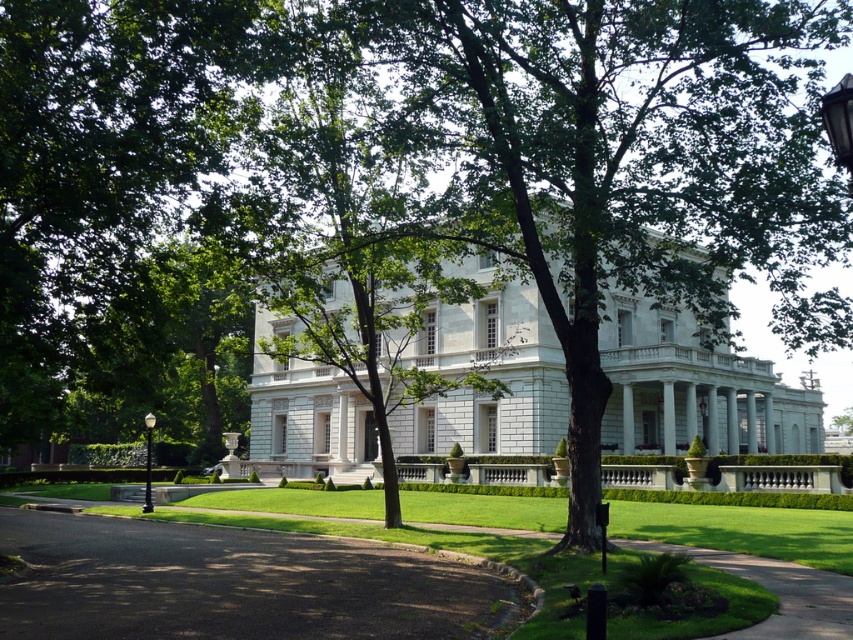
Question: Which object is positioned farthest from the white stone mansion at center?

Choices:
 (A) black polished metal lamp post at left
 (B) dark asphalt driveway at lower left
 (C) black glass lamp post at upper right

Answer: (C)

Question: Which of the following is the closest to the observer?

Choices:
 (A) black glass lamp post at upper right
 (B) white stone mansion at center
 (C) black polished metal lamp post at left
 (D) dark asphalt driveway at lower left

Answer: (A)

Question: Can you confirm if white stone mansion at center is positioned to the right of black glass lamp post at upper right?

Choices:
 (A) no
 (B) yes

Answer: (B)

Question: Which object is positioned farthest from the black glass lamp post at upper right?

Choices:
 (A) dark asphalt driveway at lower left
 (B) white stone mansion at center

Answer: (B)

Question: Does white stone mansion at center lie behind dark asphalt driveway at lower left?

Choices:
 (A) yes
 (B) no

Answer: (A)

Question: From the image, what is the correct spatial relationship of white stone mansion at center in relation to black polished metal lamp post at left?

Choices:
 (A) below
 (B) above

Answer: (B)